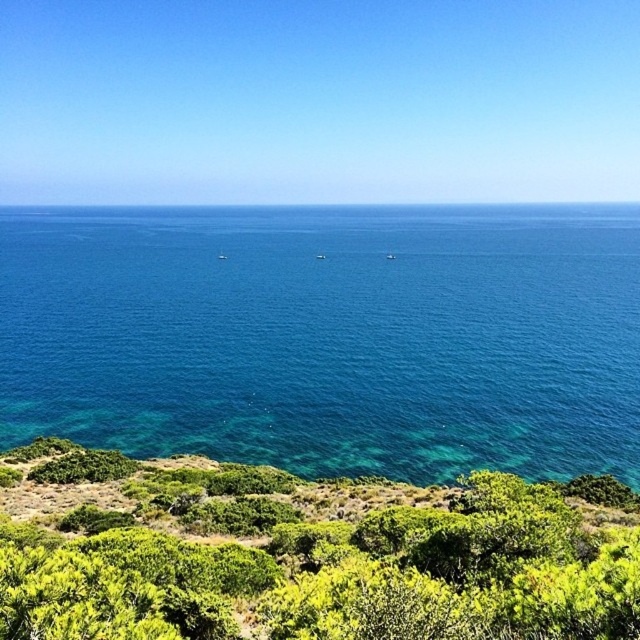
You are standing at the edge of the coastal landscape and want to walk towards the clear blue water at center. However, there are green leafy shrubs at lower center in your path. Based on their widths, can you estimate if you can walk around the shrubs without stepping on them?

The clear blue water at center is wider than the green leafy shrubs at lower center, so yes, you can walk around the green leafy shrubs at lower center without stepping on them as there is enough space.

You are standing at the edge of the coastal landscape and want to determine which object is taller between the clear blue water at center and the green leafy shrubs at lower center. Based on the scene, which one is taller?

The clear blue water at center is taller than the green leafy shrubs at lower center according to the description.

You are standing on the beach and see the clear blue water at center and the green leafy shrubs at lower center. Which object is closer to your feet?

The green leafy shrubs at lower center are closer to your feet since they are positioned below the clear blue water at center.